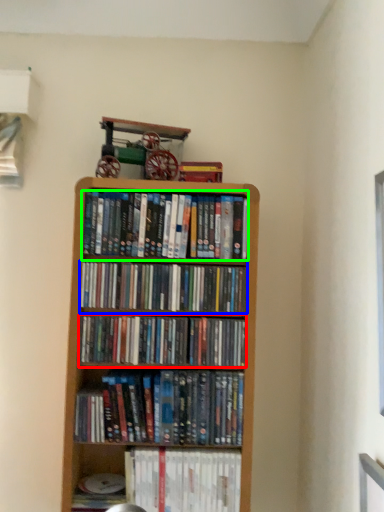
Question: Which is farther away from book (highlighted by a red box)? book (highlighted by a blue box) or book (highlighted by a green box)?

Choices:
 (A) book
 (B) book

Answer: (B)